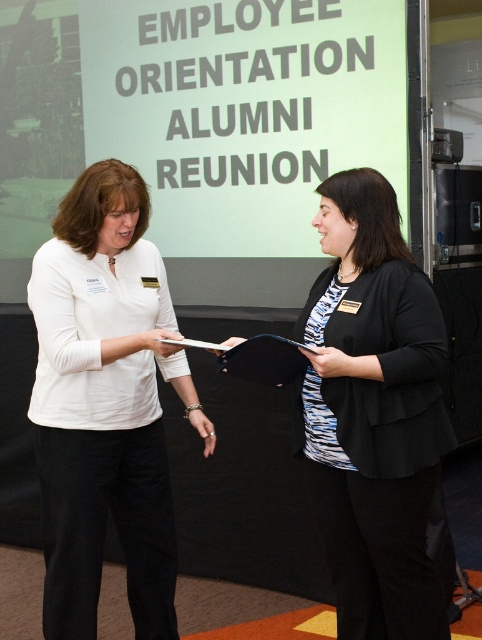
You are an event photographer at the back of the room. You need to take a photo of the two women so that both their name tags are clearly visible. The white matte shirt at center and the black matte blazer at center are in your view. Which object should you adjust your camera angle to focus on to ensure both name tags are visible?

The white matte shirt at center is positioned under the black matte blazer at center, so adjusting the camera angle to focus on the lower area where the white matte shirt at center is located will ensure both name tags are visible.

You are organizing a presentation and need to place a name tag on the table. The name tag is wider than the black matte folder at center. Where should you place the name tag so it doesn not overlap with the black matte blazer at center?

Since the black matte blazer at center is to the right of the black matte folder at center, place the name tag to the left of the black matte folder at center to avoid overlapping with the blazer.